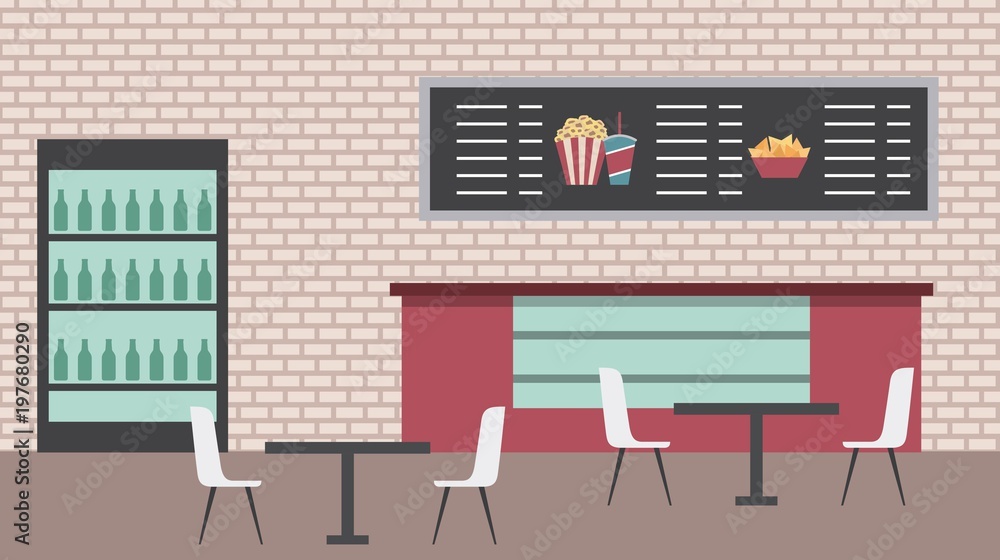
This screenshot has height=560, width=1000. What are the coordinates of `table` in the screenshot? It's located at (749, 483), (344, 526).